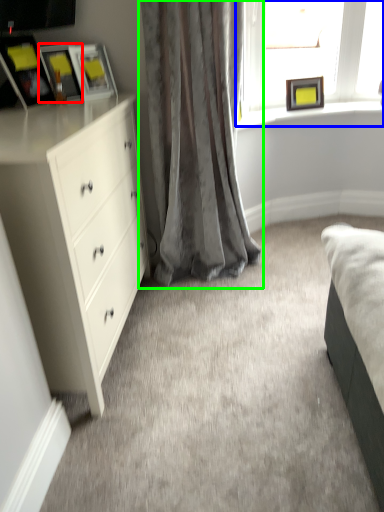
Question: Estimate the real-world distances between objects in this image. Which object is closer to picture frame (highlighted by a red box), window (highlighted by a blue box) or curtain (highlighted by a green box)?

Choices:
 (A) window
 (B) curtain

Answer: (B)